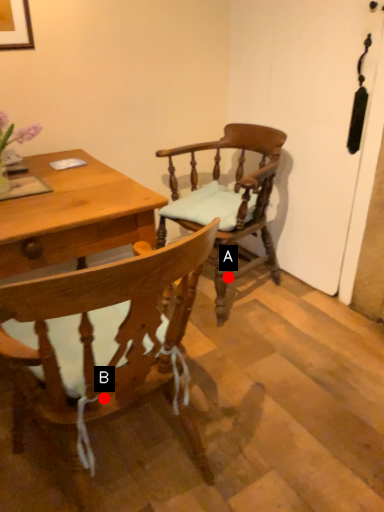
Question: Two points are circled on the image, labeled by A and B beside each circle. Which point appears closest to the camera in this image?

Choices:
 (A) A is closer
 (B) B is closer

Answer: (B)